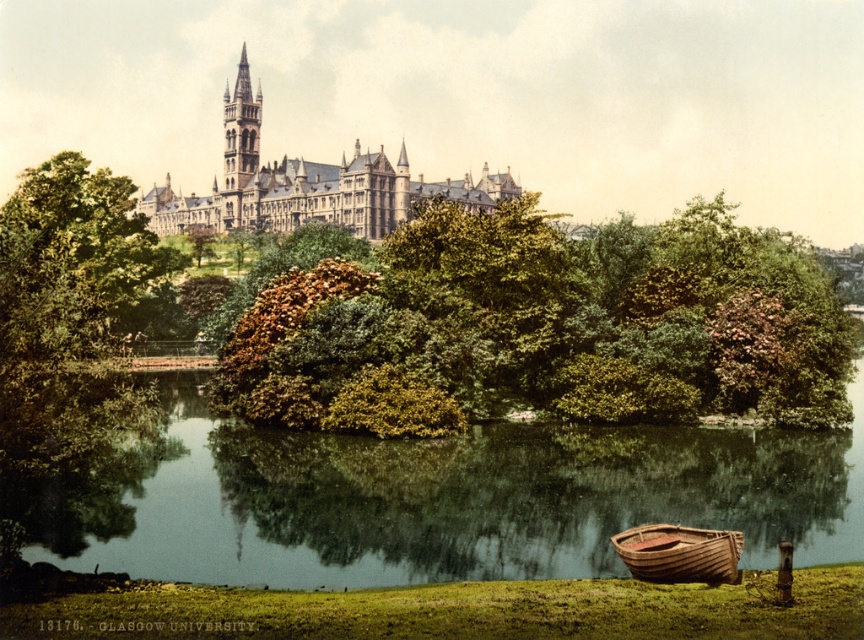
Question: Is stone castle at upper center behind golden stone tower at upper center?

Choices:
 (A) yes
 (B) no

Answer: (B)

Question: Among these points, which one is nearest to the camera?

Choices:
 (A) (201, 225)
 (B) (124, 296)

Answer: (B)

Question: Where is green leafy tree at left located in relation to green leafy tree at center in the image?

Choices:
 (A) below
 (B) above

Answer: (A)

Question: Is stone castle at upper center closer to the viewer compared to wooden boat at lower right?

Choices:
 (A) no
 (B) yes

Answer: (A)

Question: Which point is farther to the camera?

Choices:
 (A) (703, 353)
 (B) (204, 440)

Answer: (A)

Question: Which is farther from the stone castle at upper center?

Choices:
 (A) golden stone tower at upper center
 (B) green leafy tree at center

Answer: (B)